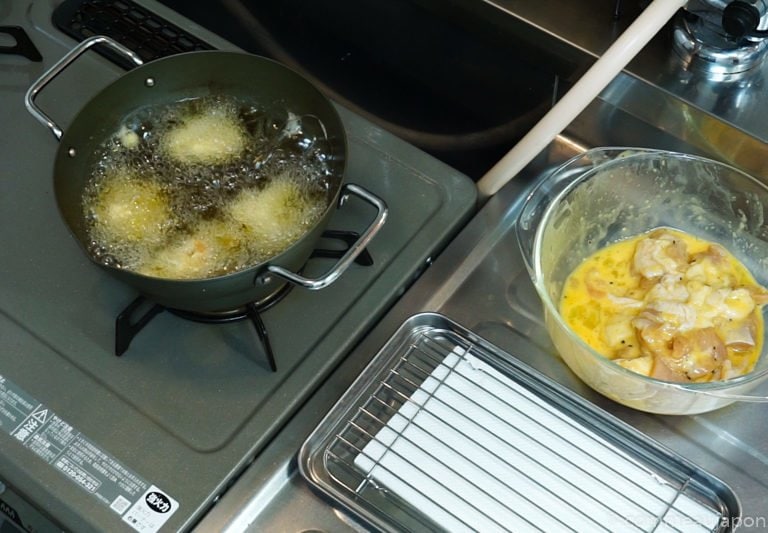
Where is `silver tray pan`? The height and width of the screenshot is (533, 768). silver tray pan is located at coordinates (322, 487).